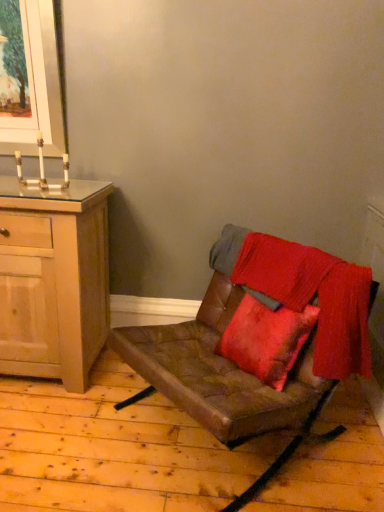
Question: Is brown leather chair at center taller or shorter than light wood cabinet at left?

Choices:
 (A) tall
 (B) short

Answer: (B)

Question: Based on their sizes in the image, would you say brown leather chair at center is bigger or smaller than light wood cabinet at left?

Choices:
 (A) big
 (B) small

Answer: (A)

Question: Is brown leather chair at center in front of or behind light wood cabinet at left in the image?

Choices:
 (A) behind
 (B) front

Answer: (B)

Question: In the image, is light wood cabinet at left positioned in front of or behind brown leather chair at center?

Choices:
 (A) front
 (B) behind

Answer: (B)

Question: In terms of width, does light wood cabinet at left look wider or thinner when compared to brown leather chair at center?

Choices:
 (A) thin
 (B) wide

Answer: (A)

Question: From a real-world perspective, is light wood cabinet at left above or below brown leather chair at center?

Choices:
 (A) below
 (B) above

Answer: (B)

Question: From the image's perspective, is light wood cabinet at left positioned above or below brown leather chair at center?

Choices:
 (A) below
 (B) above

Answer: (B)